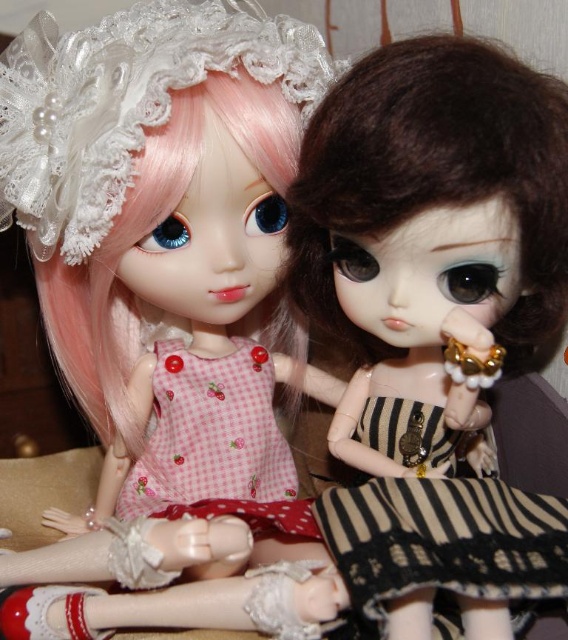
Does matte pink hair at upper left have a greater width compared to pink checkered fabric dress at center?

Yes.

Can you confirm if matte pink hair at upper left is positioned below pink checkered fabric dress at center?

No.

Between point (272, 516) and point (265, 508), which one is positioned in front?

Point (272, 516)

Image resolution: width=568 pixels, height=640 pixels. I want to click on matte pink hair at upper left, so click(168, 314).

Does matte black doll at center appear over pink checkered fabric dress at center?

Correct, matte black doll at center is located above pink checkered fabric dress at center.

The image size is (568, 640). I want to click on matte black doll at center, so click(433, 317).

Which is in front, point (323, 314) or point (494, 508)?

Point (494, 508) is in front.

Can you confirm if matte black doll at center is taller than black striped fabric at center?

Indeed, matte black doll at center has a greater height compared to black striped fabric at center.

Does point (471, 232) lie behind point (436, 451)?

No, (471, 232) is in front of (436, 451).

Find the location of `matte black doll at center`. matte black doll at center is located at coordinates (433, 317).